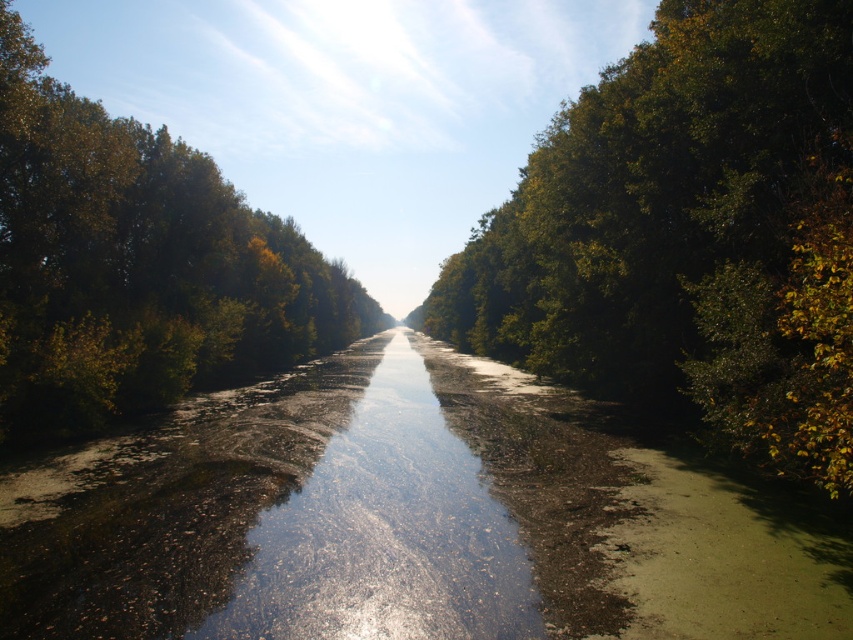
You are a painter setting up your easel by the waterway. You want to capture the contrast between the green leafy tree at right and the green leafy trees at left. Which tree should you focus on if you want to emphasize the difference in their thickness?

The green leafy tree at right is thinner than the green leafy trees at left, so focusing on the green leafy tree at right will highlight the contrast in their thickness.

You are an observer standing at the center of the waterway. You notice the green leafy tree at right and the green leafy trees at left. Which group of trees appears taller from your perspective?

The green leafy trees at left appear taller than the green leafy tree at right.

You are a kayaker planning to navigate a narrow section of the waterway between the green leafy tree at right and the green leafy trees at left. The kayak requires at least 60 feet of space to pass safely. Can you determine if there is enough space between them for your kayak?

The distance between the green leafy tree at right and the green leafy trees at left is 64.56 feet, which is more than the required 60 feet. Therefore, there is sufficient space for the kayak to pass safely.